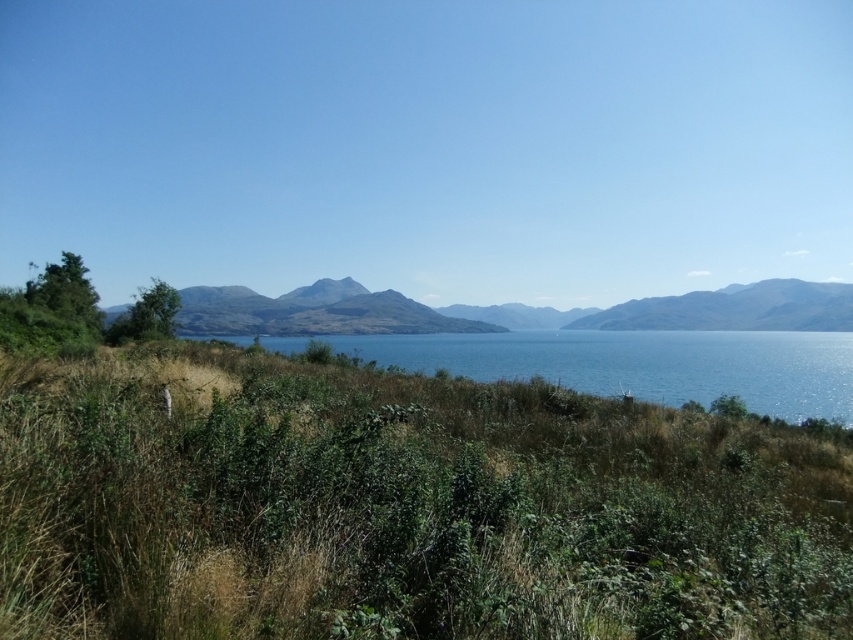
You are standing at the edge of the grassy area and want to walk to the mountain. Which direction should you head to reach the smooth gray mountain at center from the green grassy at lower center?

To reach the smooth gray mountain at center from the green grassy at lower center, you should head towards the center of the image, as the mountain is positioned centrally relative to the grassy area at the lower part of the scene.

You are standing in the foreground of the serene landscape and want to reach both the point at (657, 330) and the point at (248, 321). Which point is closer to you?

Point (248, 321) is closer to you because it is nearer than point (657, 330), which is further away from the camera.